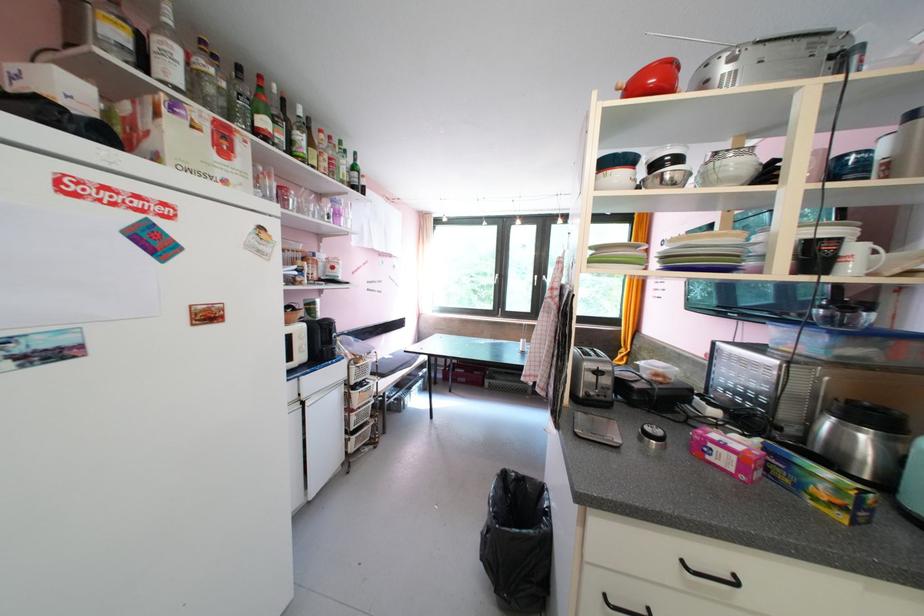
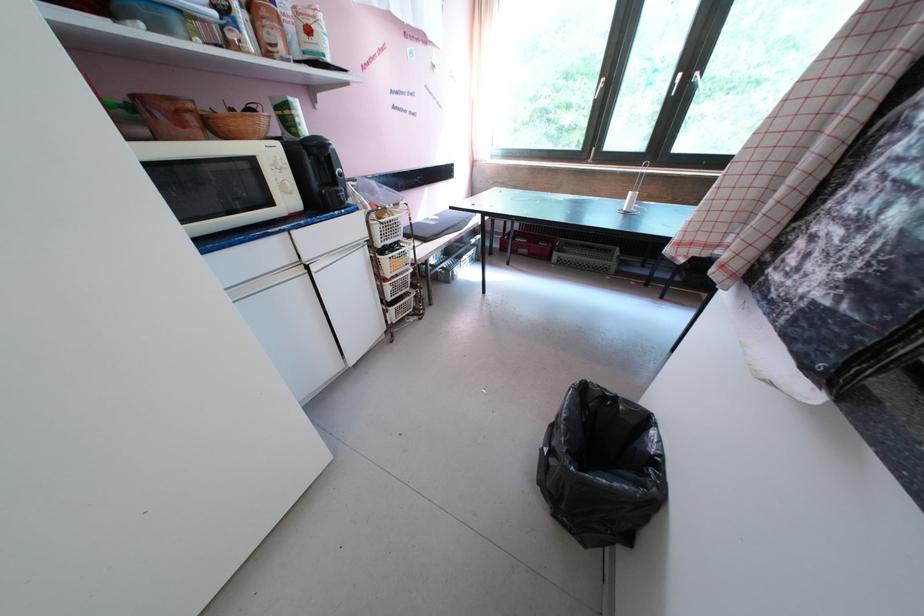
Question: How did the camera likely rotate?

Choices:
 (A) Left
 (B) Right
 (C) Up
 (D) Down

Answer: (D)